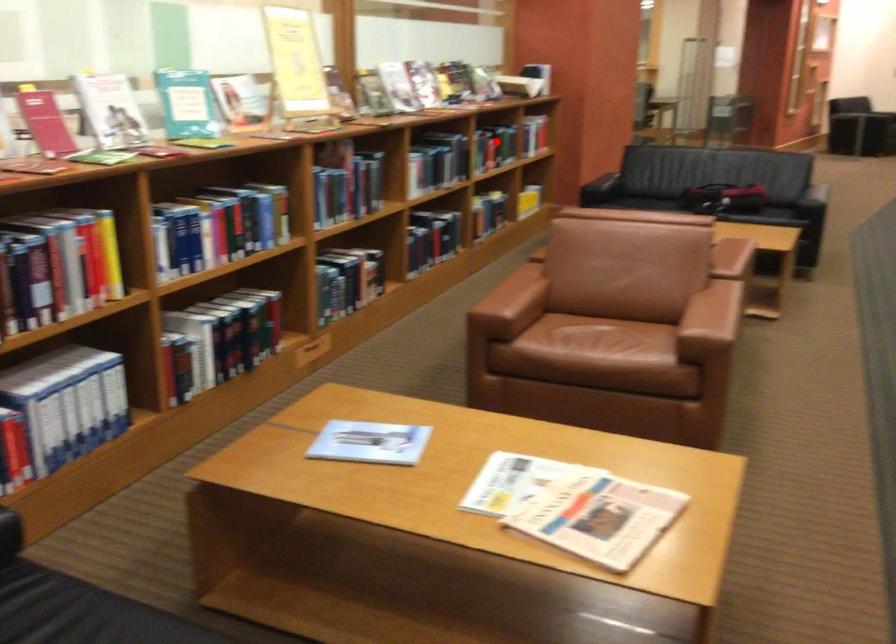
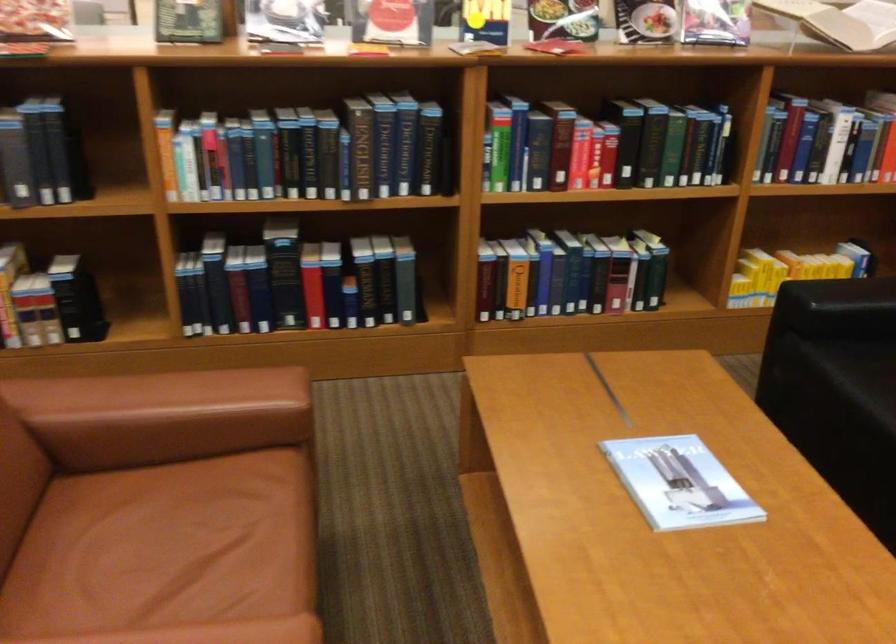
Question: I am providing you with two images of the same scene from different viewpoints. In image1, a red point is highlighted. Considering the same 3D point in image2, which of the following is correct?

Choices:
 (A) It is closer
 (B) It is farther

Answer: (A)